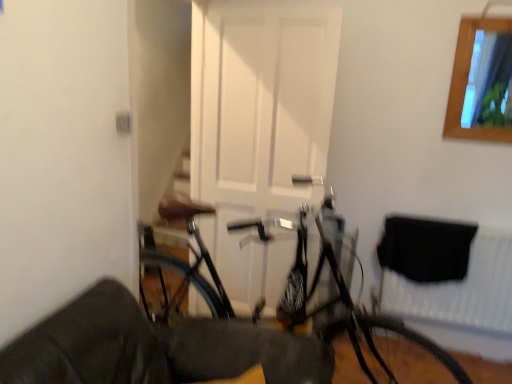
Question: Should I look upward or downward to see black fabric at lower right?

Choices:
 (A) up
 (B) down

Answer: (B)

Question: Is black fabric at lower right outside shiny black tire at lower right?

Choices:
 (A) yes
 (B) no

Answer: (A)

Question: Is black fabric at lower right wider than shiny black tire at lower right?

Choices:
 (A) no
 (B) yes

Answer: (A)

Question: Does black fabric at lower right come in front of shiny black tire at lower right?

Choices:
 (A) no
 (B) yes

Answer: (A)

Question: From a real-world perspective, does black fabric at lower right sit lower than shiny black tire at lower right?

Choices:
 (A) yes
 (B) no

Answer: (B)

Question: From the image's perspective, is black fabric at lower right below shiny black tire at lower right?

Choices:
 (A) no
 (B) yes

Answer: (A)

Question: Is black fabric at lower right to the left of shiny black tire at lower right from the viewer's perspective?

Choices:
 (A) yes
 (B) no

Answer: (B)

Question: From the image's perspective, is wooden frame at upper right on white matte door at center?

Choices:
 (A) yes
 (B) no

Answer: (A)

Question: From a real-world perspective, is wooden frame at upper right located beneath white matte door at center?

Choices:
 (A) yes
 (B) no

Answer: (B)

Question: Is wooden frame at upper right positioned far away from white matte door at center?

Choices:
 (A) no
 (B) yes

Answer: (B)

Question: Is wooden frame at upper right looking in the opposite direction of white matte door at center?

Choices:
 (A) yes
 (B) no

Answer: (B)

Question: Are wooden frame at upper right and white matte door at center making contact?

Choices:
 (A) no
 (B) yes

Answer: (A)

Question: Is wooden frame at upper right wider than white matte door at center?

Choices:
 (A) yes
 (B) no

Answer: (B)

Question: Considering the relative sizes of shiny metallic bicycle at center and black fabric at lower right in the image provided, is shiny metallic bicycle at center shorter than black fabric at lower right?

Choices:
 (A) no
 (B) yes

Answer: (A)